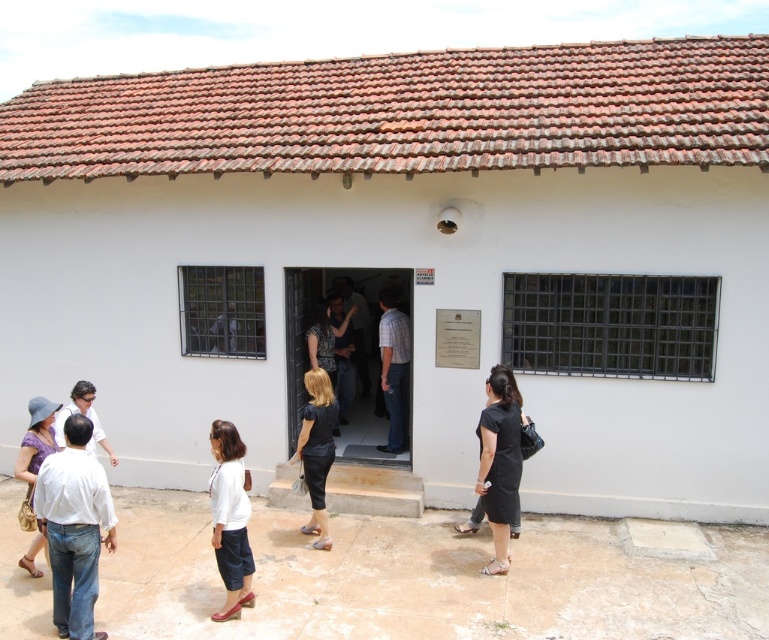
Question: Is white matte shirt at lower center to the left of plaid shirt at center from the viewer's perspective?

Choices:
 (A) yes
 (B) no

Answer: (A)

Question: Which point is closer to the camera?

Choices:
 (A) (232, 497)
 (B) (321, 394)

Answer: (A)

Question: Does plaid shirt at center appear on the left side of purple fabric hat at upper left?

Choices:
 (A) yes
 (B) no

Answer: (B)

Question: Considering the relative positions of black matte dress at center and dark gray fabric dress at center in the image provided, where is black matte dress at center located with respect to dark gray fabric dress at center?

Choices:
 (A) right
 (B) left

Answer: (B)

Question: Which of the following is the closest to the observer?

Choices:
 (A) black matte dress at center
 (B) dark gray fabric dress at center
 (C) white matte shirt at lower center

Answer: (C)

Question: Estimate the real-world distances between objects in this image. Which object is closer to the white matte shirt at lower center?

Choices:
 (A) black matte dress at lower center
 (B) plaid shirt at center
 (C) black matte dress at center
 (D) purple fabric hat at upper left

Answer: (C)